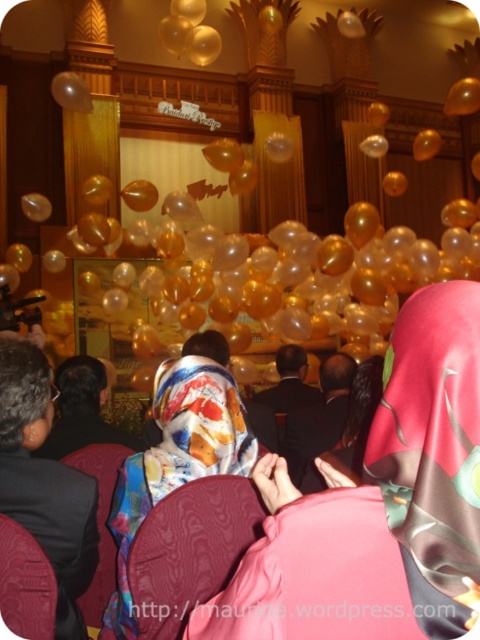
Can you confirm if silky floral hijab at center is bigger than translucent gold balloon at upper center?

Actually, silky floral hijab at center might be smaller than translucent gold balloon at upper center.

What do you see at coordinates (376, 506) in the screenshot? The image size is (480, 640). I see `silky floral hijab at center` at bounding box center [376, 506].

I want to click on silky floral hijab at center, so click(x=376, y=506).

How much distance is there between silky floral hijab at center and floral silk hijab at center?

9.87 feet

Which is behind, point (433, 449) or point (186, 397)?

Point (186, 397)

Which is in front, point (250, 580) or point (122, 618)?

Point (250, 580)

In order to click on silky floral hijab at center in this screenshot , I will do `click(376, 506)`.

Does floral silk hijab at center have a lesser width compared to translucent gold balloon at upper center?

Indeed, floral silk hijab at center has a lesser width compared to translucent gold balloon at upper center.

Is floral silk hijab at center below translucent gold balloon at upper center?

Yes, floral silk hijab at center is below translucent gold balloon at upper center.

Who is more distant from viewer, (171, 472) or (60, 97)?

The point (60, 97) is more distant.

Image resolution: width=480 pixels, height=640 pixels. I want to click on floral silk hijab at center, so click(176, 460).